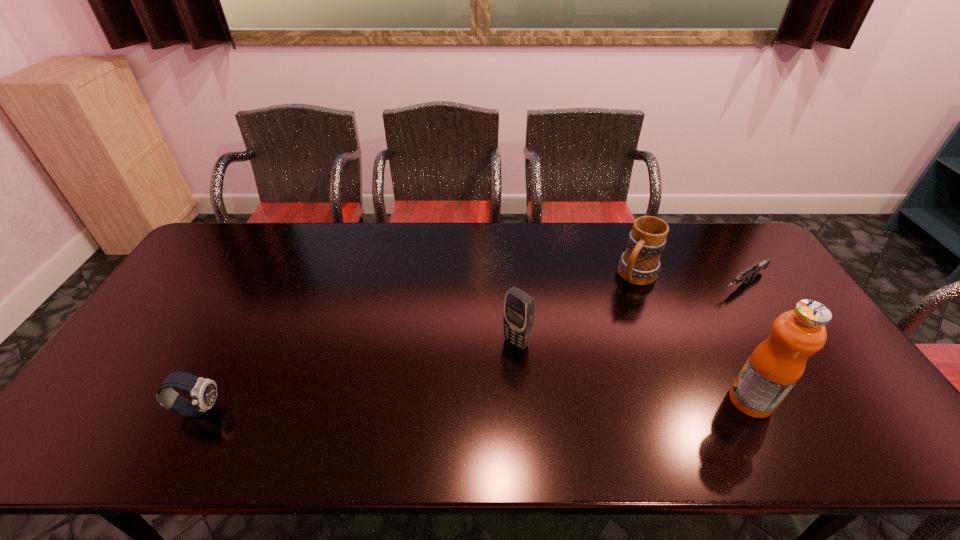
What are the coordinates of `object that is at the far edge` in the screenshot? It's located at (640, 264).

Image resolution: width=960 pixels, height=540 pixels. Identify the location of watch located in the near edge section of the desktop. (203, 391).

Find the location of a particular element. The image size is (960, 540). fruit juice situated at the near edge is located at coordinates [774, 367].

Where is `object that is at the right edge`? The height and width of the screenshot is (540, 960). object that is at the right edge is located at coordinates (757, 267).

Find the location of `vacant space at the far edge of the desktop`. vacant space at the far edge of the desktop is located at coordinates (285, 225).

Image resolution: width=960 pixels, height=540 pixels. In the image, there is a desktop. What are the coordinates of `vacant area at the near edge` in the screenshot? It's located at tap(538, 400).

At what (x,y) coordinates should I click in order to perform the action: click on vacant space at the left edge of the desktop. Please return your answer as a coordinate pair (x, y). Image resolution: width=960 pixels, height=540 pixels. Looking at the image, I should click on (173, 320).

In the image, there is a desktop. At what (x,y) coordinates should I click in order to perform the action: click on vacant space at the right edge. Please return your answer as a coordinate pair (x, y). Looking at the image, I should click on (756, 289).

At what (x,y) coordinates should I click in order to perform the action: click on vacant space at the far left corner of the desktop. Please return your answer as a coordinate pair (x, y). This screenshot has width=960, height=540. Looking at the image, I should click on (252, 237).

The height and width of the screenshot is (540, 960). I want to click on free space at the near left corner of the desktop, so click(156, 391).